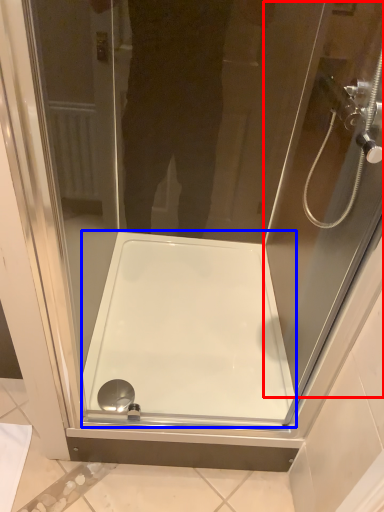
Question: Among these objects, which one is farthest to the camera, screen door (highlighted by a red box) or bath (highlighted by a blue box)?

Choices:
 (A) screen door
 (B) bath

Answer: (B)